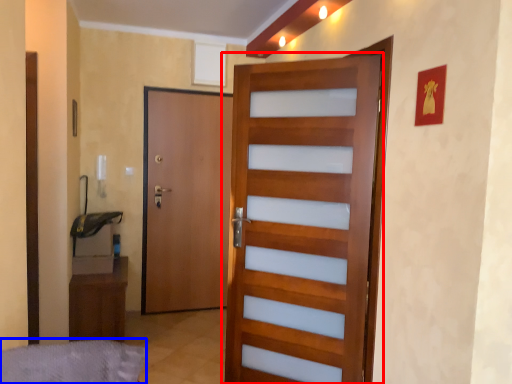
Question: Which of the following is the closest to the observer, door (highlighted by a red box) or bed frame (highlighted by a blue box)?

Choices:
 (A) door
 (B) bed frame

Answer: (B)